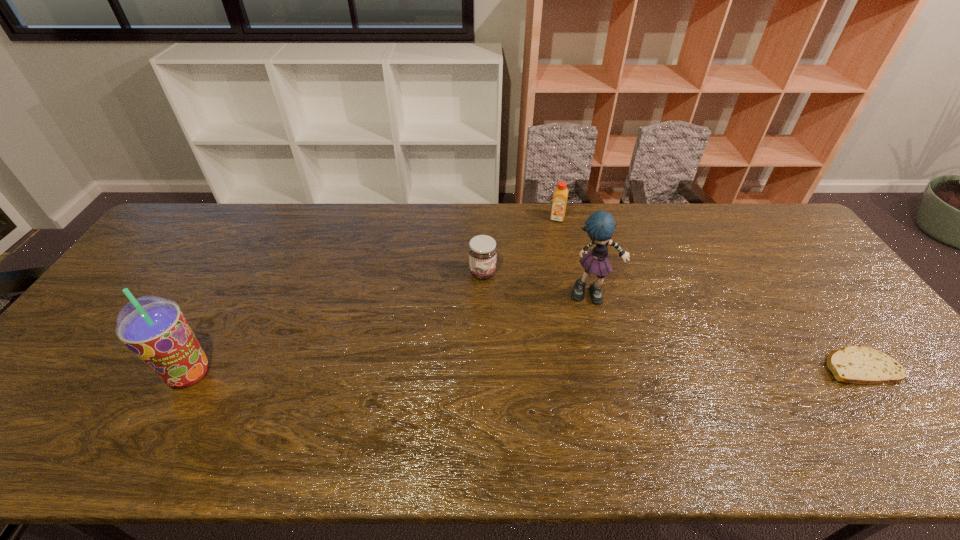
Identify the location of smoothie that is positioned at the near edge. (153, 328).

Locate an element on the screen. This screenshot has width=960, height=540. pita bread that is positioned at the near edge is located at coordinates (853, 364).

The image size is (960, 540). I want to click on object that is positioned at the right edge, so click(853, 364).

I want to click on object that is at the near right corner, so click(853, 364).

Image resolution: width=960 pixels, height=540 pixels. I want to click on vacant region at the far edge, so click(325, 212).

Locate an element on the screen. The height and width of the screenshot is (540, 960). free space at the near edge of the desktop is located at coordinates (626, 392).

At what (x,y) coordinates should I click in order to perform the action: click on vacant region at the far left corner. Please return your answer as a coordinate pair (x, y). Image resolution: width=960 pixels, height=540 pixels. Looking at the image, I should click on (211, 236).

Locate an element on the screen. This screenshot has height=540, width=960. vacant area that lies between the smoothie and the third farthest object is located at coordinates (391, 334).

You are a GUI agent. You are given a task and a screenshot of the screen. Output one action in this format:
    pyautogui.click(x=<x>, y=<y>)
    Task: Click on the vacant area between the orange juice and the leftmost object
    This screenshot has height=540, width=960.
    Given the screenshot: What is the action you would take?
    pyautogui.click(x=373, y=296)

Identify the location of unoccupied position between the jam and the leftmost object. Image resolution: width=960 pixels, height=540 pixels. (336, 323).